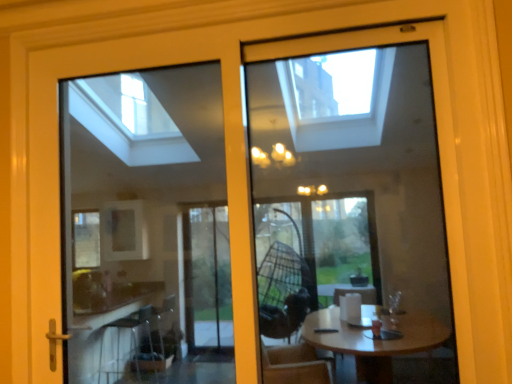
This screenshot has width=512, height=384. Describe the element at coordinates (350, 203) in the screenshot. I see `white plastic window frame at upper center` at that location.

This screenshot has height=384, width=512. Identify the location of white plastic window frame at upper center. (350, 203).

Measure the distance between white plastic window frame at upper center and camera.

The distance of white plastic window frame at upper center from camera is 2.67 meters.

What are the coordinates of `white plastic window frame at upper center` in the screenshot? It's located at (350, 203).